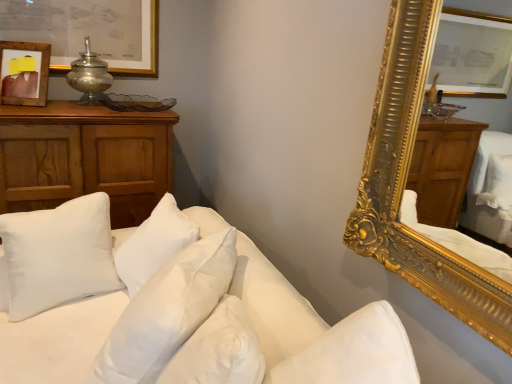
Locate an element on the screen. The height and width of the screenshot is (384, 512). metallic silver table lamp at upper left is located at coordinates (89, 77).

This screenshot has height=384, width=512. Identify the location of wooden cabinet at left. (84, 158).

The image size is (512, 384). What do you see at coordinates (24, 73) in the screenshot? I see `wooden picture frame at upper left` at bounding box center [24, 73].

At what (x,y) coordinates should I click in order to perform the action: click on metallic silver table lamp at upper left. Please return your answer as a coordinate pair (x, y). This screenshot has width=512, height=384. Looking at the image, I should click on (89, 77).

Can you tell me how much white soft pillow at left, the 1th pillow in the back-to-front sequence, and wooden picture frame at upper left differ in facing direction?

The angular difference between white soft pillow at left, the 1th pillow in the back-to-front sequence, and wooden picture frame at upper left is 30.8 degrees.

Consider the image. Which of these two, white soft pillow at left, which appears as the second pillow when viewed from the right, or wooden picture frame at upper left, is wider?

Wider between the two is white soft pillow at left, which appears as the second pillow when viewed from the right.

Which object is closer to the camera taking this photo, white soft pillow at left, positioned as the 1th pillow in left-to-right order, or wooden picture frame at upper left?

white soft pillow at left, positioned as the 1th pillow in left-to-right order, is more forward.

Does metallic silver table lamp at upper left have a larger size compared to wooden picture frame at upper left?

Yes, metallic silver table lamp at upper left is bigger than wooden picture frame at upper left.

Between metallic silver table lamp at upper left and wooden picture frame at upper left, which one has more height?

With more height is metallic silver table lamp at upper left.

Which is behind, point (85, 69) or point (32, 91)?

Point (85, 69)

Based on the photo, is metallic silver table lamp at upper left to the right of wooden picture frame at upper left from the viewer's perspective?

Indeed, metallic silver table lamp at upper left is positioned on the right side of wooden picture frame at upper left.

Locate an element on the screen. The width and height of the screenshot is (512, 384). pillow to the left of white soft pillow at center, the first pillow in the front-to-back sequence is located at coordinates (57, 255).

Is white soft pillow at left, which appears as the second pillow when viewed from the right, further to camera compared to white soft pillow at center, which is the first pillow from right to left?

Yes, white soft pillow at left, which appears as the second pillow when viewed from the right, is further from the viewer.

How many degrees apart are the facing directions of white soft pillow at left, the 1th pillow in the back-to-front sequence, and white soft pillow at center, the second pillow in the left-to-right sequence?

115 degrees separate the facing orientations of white soft pillow at left, the 1th pillow in the back-to-front sequence, and white soft pillow at center, the second pillow in the left-to-right sequence.

Is white soft pillow at center, which is the first pillow from right to left, surrounded by white soft pillow at left, positioned as the 1th pillow in left-to-right order?

No.

Which object is thinner, white soft pillows at lower left or wooden picture frame at upper left?

wooden picture frame at upper left is thinner.

From the image's perspective, does white soft pillows at lower left appear lower than wooden picture frame at upper left?

Yes.

Is white soft pillows at lower left directly adjacent to wooden picture frame at upper left?

They are not placed beside each other.

Is white soft pillows at lower left completely or partially outside of wooden picture frame at upper left?

white soft pillows at lower left lies outside wooden picture frame at upper left's area.

Between point (21, 100) and point (73, 233), which one is positioned behind?

The point (21, 100) is farther.

Which object is further away from the camera taking this photo, wooden picture frame at upper left or white soft pillow at left, which appears as the second pillow when viewed from the right?

wooden picture frame at upper left is behind.

Would you say wooden picture frame at upper left is a long distance from white soft pillow at left, positioned as the 1th pillow in left-to-right order?

No.

From the image's perspective, does wooden picture frame at upper left appear lower than white soft pillow at left, the 1th pillow in the back-to-front sequence?

Actually, wooden picture frame at upper left appears above white soft pillow at left, the 1th pillow in the back-to-front sequence, in the image.

Is wooden cabinet at left looking in the opposite direction of white soft pillow at center, the second pillow in the left-to-right sequence?

No, wooden cabinet at left is not facing away from white soft pillow at center, the second pillow in the left-to-right sequence.

From a real-world perspective, is wooden cabinet at left below white soft pillow at center, the first pillow in the front-to-back sequence?

Correct, in the physical world, wooden cabinet at left is lower than white soft pillow at center, the first pillow in the front-to-back sequence.

You are a GUI agent. You are given a task and a screenshot of the screen. Output one action in this format:
    pyautogui.click(x=<x>, y=<y>)
    Task: Click on the pillow that is above the wooden cabinet at left (from a real-world perspective)
    The image size is (512, 384).
    Given the screenshot: What is the action you would take?
    pyautogui.click(x=167, y=311)

From a real-world perspective, which is physically above, metallic silver table lamp at upper left or wooden cabinet at left?

In real-world perspective, metallic silver table lamp at upper left is above.

Considering the relative sizes of metallic silver table lamp at upper left and wooden cabinet at left in the image provided, is metallic silver table lamp at upper left thinner than wooden cabinet at left?

Indeed, metallic silver table lamp at upper left has a lesser width compared to wooden cabinet at left.

In the image, is metallic silver table lamp at upper left positioned in front of or behind wooden cabinet at left?

Visually, metallic silver table lamp at upper left is located behind wooden cabinet at left.

From the wooden picture frame at upper left, count 1st pillows forward and point to it. Please provide its 2D coordinates.

[(57, 255)]

This screenshot has height=384, width=512. I want to click on table lamp above the wooden picture frame at upper left (from the image's perspective), so click(89, 77).

Looking at the image, which one is located closer to white soft pillows at lower left, white soft pillow at left, arranged as the 2th pillow when viewed from the front, or wooden picture frame at upper left?

white soft pillow at left, arranged as the 2th pillow when viewed from the front, lies closer to white soft pillows at lower left than the other object.

Considering their positions, is white soft pillow at left, the 1th pillow in the back-to-front sequence, positioned closer to wooden picture frame at upper left than white soft pillows at lower left?

white soft pillow at left, the 1th pillow in the back-to-front sequence, lies closer to wooden picture frame at upper left than the other object.

From the image, which object appears to be farther from wooden cabinet at left, white soft pillows at lower left or white soft pillow at left, which appears as the second pillow when viewed from the right?

white soft pillows at lower left is positioned further to the anchor wooden cabinet at left.

Considering their positions, is white soft pillow at left, positioned as the 1th pillow in left-to-right order, positioned closer to white soft pillows at lower left than metallic silver table lamp at upper left?

white soft pillow at left, positioned as the 1th pillow in left-to-right order.

Looking at the image, which one is located further to white soft pillows at lower left, white soft pillow at center, the first pillow in the front-to-back sequence, or white soft pillow at left, the 1th pillow in the back-to-front sequence?

white soft pillow at left, the 1th pillow in the back-to-front sequence, is positioned further to the anchor white soft pillows at lower left.

Which object lies further to the anchor point white soft pillows at lower left, wooden cabinet at left or wooden picture frame at upper left?

wooden picture frame at upper left lies further to white soft pillows at lower left than the other object.

From the image, which object appears to be farther from white soft pillow at left, positioned as the 1th pillow in left-to-right order, wooden cabinet at left or wooden picture frame at upper left?

Among the two, wooden picture frame at upper left is located further to white soft pillow at left, positioned as the 1th pillow in left-to-right order.

Estimate the real-world distances between objects in this image. Which object is further from wooden picture frame at upper left, white soft pillow at left, positioned as the 1th pillow in left-to-right order, or white soft pillow at center, positioned as the 2th pillow in back-to-front order?

Among the two, white soft pillow at center, positioned as the 2th pillow in back-to-front order, is located further to wooden picture frame at upper left.

The height and width of the screenshot is (384, 512). In order to click on pillow between white soft pillows at lower left and wooden cabinet at left along the z-axis in this screenshot , I will do `click(57, 255)`.

Find the location of a particular element. This screenshot has width=512, height=384. cabinetry positioned between white soft pillow at center, which is the first pillow from right to left, and metallic silver table lamp at upper left from near to far is located at coordinates (84, 158).

At what (x,y) coordinates should I click in order to perform the action: click on pillow between white soft pillow at center, the first pillow in the front-to-back sequence, and wooden cabinet at left in the front-back direction. Please return your answer as a coordinate pair (x, y). Looking at the image, I should click on (57, 255).

This screenshot has width=512, height=384. In order to click on studio couch between white soft pillow at center, the first pillow in the front-to-back sequence, and wooden picture frame at upper left in the front-back direction in this screenshot , I will do `click(173, 308)`.